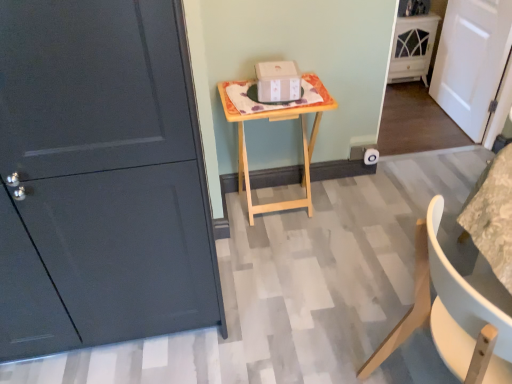
What are the coordinates of `white glossy cabinet at upper right` in the screenshot? It's located at (412, 48).

The image size is (512, 384). What do you see at coordinates (278, 82) in the screenshot?
I see `white cardboard box at center` at bounding box center [278, 82].

What do you see at coordinates (100, 178) in the screenshot?
I see `matte dark gray door at left, marked as the second door in a back-to-front arrangement` at bounding box center [100, 178].

This screenshot has height=384, width=512. I want to click on matte dark gray door at left, positioned as the 1th door in left-to-right order, so click(100, 178).

What do you see at coordinates (471, 61) in the screenshot? This screenshot has height=384, width=512. I see `white matte door at right, the 1th door when ordered from right to left` at bounding box center [471, 61].

This screenshot has width=512, height=384. Find the location of `white matte chair at lower right`. white matte chair at lower right is located at coordinates (452, 309).

Between white matte door at right, the 1th door when ordered from right to left, and natural wood table at center, which one has more height?

white matte door at right, the 1th door when ordered from right to left.

This screenshot has height=384, width=512. What are the coordinates of `table located in front of the white matte door at right, the 1th door when ordered from right to left` in the screenshot? It's located at (273, 121).

Does white matte door at right, which is the 2th door from left to right, appear on the left side of natural wood table at center?

In fact, white matte door at right, which is the 2th door from left to right, is to the right of natural wood table at center.

Considering the sizes of objects natural wood table at center and white matte chair at lower right in the image provided, who is thinner, natural wood table at center or white matte chair at lower right?

Thinner between the two is natural wood table at center.

From their relative heights in the image, would you say natural wood table at center is taller or shorter than white matte chair at lower right?

Considering their sizes, natural wood table at center has less height than white matte chair at lower right.

From the picture: Does natural wood table at center have a larger size compared to white matte chair at lower right?

No.

Which object is closer to the camera taking this photo, natural wood table at center or white matte chair at lower right?

white matte chair at lower right is in front.

Which is less distant, (505, 315) or (296, 79)?

Point (505, 315) appears to be closer to the viewer than point (296, 79).

What's the angular difference between white matte chair at lower right and white cardboard box at center's facing directions?

They differ by 95.6 degrees in their facing directions.

Is white cardboard box at center at the back of white matte chair at lower right?

No, white matte chair at lower right is not facing the opposite direction of white cardboard box at center.

From the image's perspective, who appears lower, white matte chair at lower right or white cardboard box at center?

From the image's view, white matte chair at lower right is below.

Is white matte chair at lower right behind natural wood table at center?

No, white matte chair at lower right is closer to the viewer.

Image resolution: width=512 pixels, height=384 pixels. What are the coordinates of `table on the left of white matte chair at lower right` in the screenshot? It's located at (273, 121).

From the image's perspective, which object appears higher, white matte chair at lower right or natural wood table at center?

natural wood table at center is shown above in the image.

Is white matte chair at lower right taller or shorter than natural wood table at center?

In the image, white matte chair at lower right appears to be taller than natural wood table at center.

From a real-world perspective, which object stands above the other?

white cardboard box at center, from a real-world perspective.

Considering the positions of objects white cardboard box at center and white glossy cabinet at upper right in the image provided, who is more to the right, white cardboard box at center or white glossy cabinet at upper right?

Positioned to the right is white glossy cabinet at upper right.

Is white cardboard box at center closer to camera compared to white glossy cabinet at upper right?

Yes, white cardboard box at center is closer to the viewer.

Considering the sizes of objects white cardboard box at center and white glossy cabinet at upper right in the image provided, who is wider, white cardboard box at center or white glossy cabinet at upper right?

white glossy cabinet at upper right.

Who is taller, white glossy cabinet at upper right or natural wood table at center?

natural wood table at center is taller.

Is white glossy cabinet at upper right positioned before natural wood table at center?

No.

The image size is (512, 384). In order to click on the 2nd door in front of the white glossy cabinet at upper right in this screenshot , I will do `click(100, 178)`.

Are matte dark gray door at left, marked as the second door in a back-to-front arrangement, and white glossy cabinet at upper right making contact?

No, matte dark gray door at left, marked as the second door in a back-to-front arrangement, is not touching white glossy cabinet at upper right.

From the image's perspective, which one is positioned higher, matte dark gray door at left, the first door from the front, or white glossy cabinet at upper right?

white glossy cabinet at upper right, from the image's perspective.

What are the coordinates of `table in front of the white matte door at right, the second door when ordered from front to back` in the screenshot? It's located at (273, 121).

I want to click on table on the left of white matte chair at lower right, so click(273, 121).

From the image, which object appears to be nearer to white matte door at right, the 1th door when ordered from right to left, matte dark gray door at left, which is the 2th door from right to left, or white matte chair at lower right?

The object closer to white matte door at right, the 1th door when ordered from right to left, is white matte chair at lower right.

Based on their spatial positions, is white cardboard box at center or white glossy cabinet at upper right closer to white matte chair at lower right?

white cardboard box at center.

Considering their positions, is white glossy cabinet at upper right positioned closer to natural wood table at center than matte dark gray door at left, which is the 2th door from right to left?

Among the two, matte dark gray door at left, which is the 2th door from right to left, is located nearer to natural wood table at center.

Looking at the image, which one is located closer to natural wood table at center, matte dark gray door at left, positioned as the 1th door in left-to-right order, or white cardboard box at center?

Among the two, white cardboard box at center is located nearer to natural wood table at center.

Which object lies nearer to the anchor point natural wood table at center, white cardboard box at center or white matte chair at lower right?

white cardboard box at center is positioned closer to the anchor natural wood table at center.

From the image, which object appears to be farther from matte dark gray door at left, marked as the second door in a back-to-front arrangement, white cardboard box at center or natural wood table at center?

white cardboard box at center is further to matte dark gray door at left, marked as the second door in a back-to-front arrangement.

Considering their positions, is white matte chair at lower right positioned closer to white glossy cabinet at upper right than natural wood table at center?

natural wood table at center.

Looking at the image, which one is located closer to matte dark gray door at left, the first door from the front, white glossy cabinet at upper right or natural wood table at center?

natural wood table at center is positioned closer to the anchor matte dark gray door at left, the first door from the front.

Identify the location of table located between matte dark gray door at left, which is the 2th door from right to left, and white matte door at right, the second door when ordered from front to back, in the left-right direction. This screenshot has height=384, width=512. (273, 121).

Where is `table situated between matte dark gray door at left, the first door from the front, and white matte chair at lower right from left to right`? The height and width of the screenshot is (384, 512). table situated between matte dark gray door at left, the first door from the front, and white matte chair at lower right from left to right is located at coordinates (273, 121).

Where is `table between white matte chair at lower right and white cardboard box at center in the front-back direction`? This screenshot has height=384, width=512. table between white matte chair at lower right and white cardboard box at center in the front-back direction is located at coordinates (273, 121).

Image resolution: width=512 pixels, height=384 pixels. Identify the location of cardboard box located between white matte chair at lower right and white glossy cabinet at upper right in the depth direction. (278, 82).